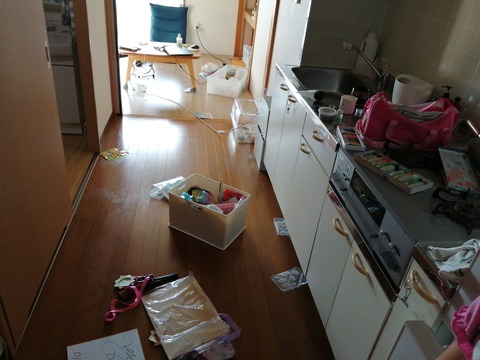
Locate an element on the screen. This screenshot has height=360, width=480. sink is located at coordinates (329, 81).